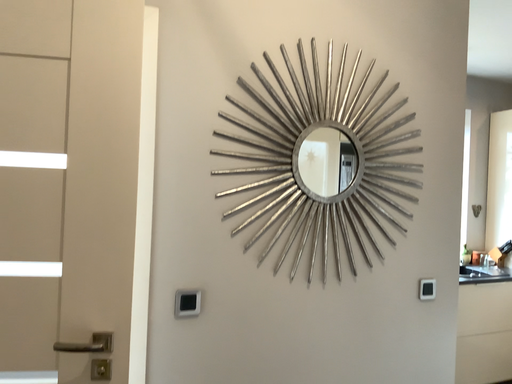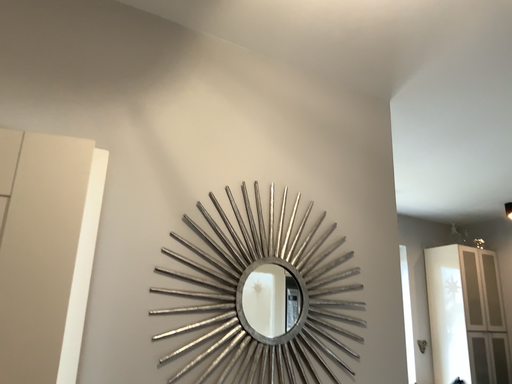
Question: Which way did the camera rotate in the video?

Choices:
 (A) rotated downward
 (B) rotated upward

Answer: (B)